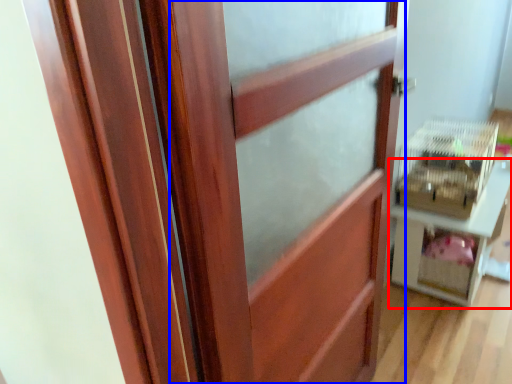
Question: Which of the following is the farthest to the observer, furniture (highlighted by a red box) or barn door (highlighted by a blue box)?

Choices:
 (A) furniture
 (B) barn door

Answer: (A)